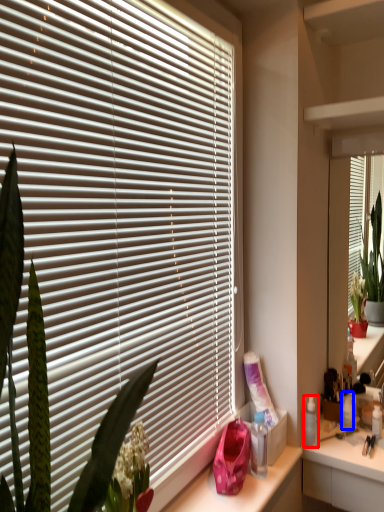
Question: Which point is closer to the camera, toiletry (highlighted by a red box) or toiletry (highlighted by a blue box)?

Choices:
 (A) toiletry
 (B) toiletry

Answer: (A)